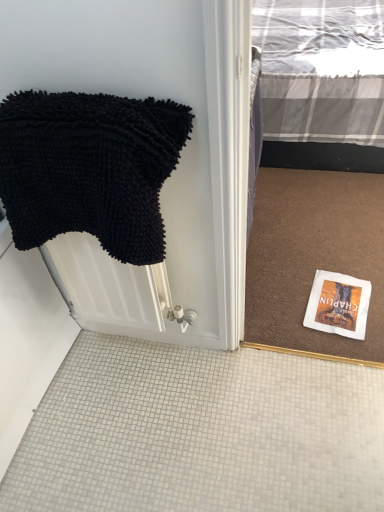
This screenshot has width=384, height=512. I want to click on vacant area situated below black chenille towel at left (from a real-world perspective), so click(x=130, y=380).